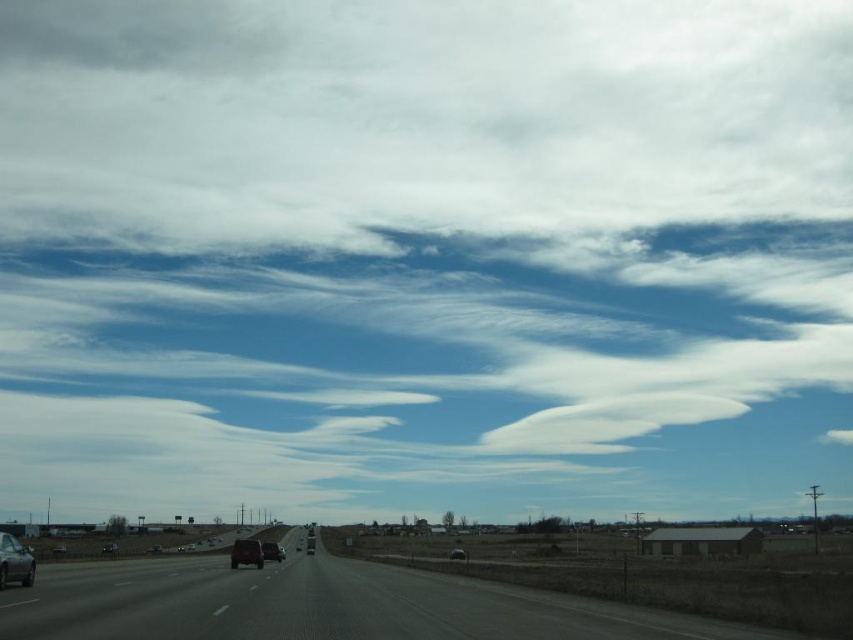
You are a photographer planning to capture a shot of the matte black car at lower left and metallic silver car at center in the rural highway scene. Which car should you focus on if you want to highlight a vehicle that is shorter in your photo?

The matte black car at lower left is shorter than the metallic silver car at center, so you should focus on the matte black car at lower left to highlight a shorter vehicle in your photo.

You are a passenger in a car and looking out the window. You notice a matte black truck at center and a metallic silver car at center. Which vehicle is positioned higher in the image?

The matte black truck at center is located above the metallic silver car at center, so it is positioned higher in the image.

Consider the image. You are a driver approaching the highway and want to merge into the right lane. You see the matte black car at lower left and the metallic silver car at center. Which car is positioned higher on the road?

The matte black car at lower left is positioned higher on the road than the metallic silver car at center.